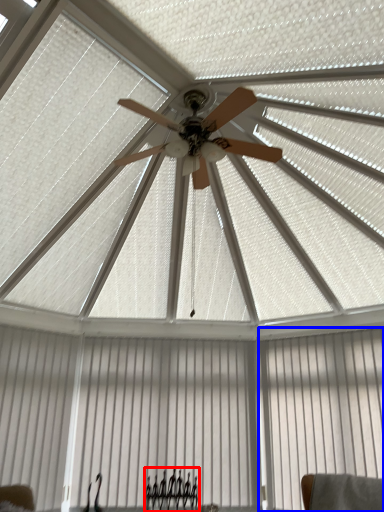
Question: Which point is closer to the camera, furniture (highlighted by a red box) or curtain (highlighted by a blue box)?

Choices:
 (A) furniture
 (B) curtain

Answer: (B)